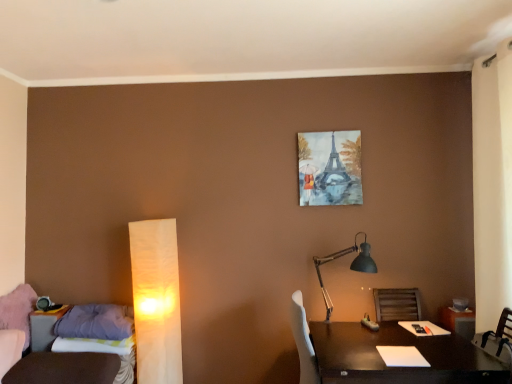
Question: Should I look upward or downward to see soft purple fabric at left?

Choices:
 (A) up
 (B) down

Answer: (B)

Question: From a real-world perspective, is purple fabric pillow at lower left beneath soft purple fabric at left?

Choices:
 (A) yes
 (B) no

Answer: (B)

Question: Are purple fabric pillow at lower left and soft purple fabric at left located far from each other?

Choices:
 (A) no
 (B) yes

Answer: (A)

Question: From the image's perspective, is purple fabric pillow at lower left on soft purple fabric at left?

Choices:
 (A) no
 (B) yes

Answer: (B)

Question: Considering the relative sizes of purple fabric pillow at lower left and soft purple fabric at left in the image provided, is purple fabric pillow at lower left shorter than soft purple fabric at left?

Choices:
 (A) yes
 (B) no

Answer: (B)

Question: Is the position of purple fabric pillow at lower left less distant than that of soft purple fabric at left?

Choices:
 (A) yes
 (B) no

Answer: (B)

Question: Is purple fabric pillow at lower left to the left of soft purple fabric at left from the viewer's perspective?

Choices:
 (A) yes
 (B) no

Answer: (B)

Question: Can you confirm if white paper lamp at left, arranged as the first lamp when viewed from the left, is taller than dark wood table at lower right?

Choices:
 (A) yes
 (B) no

Answer: (A)

Question: Does white paper lamp at left, positioned as the 2th lamp in right-to-left order, turn towards dark wood table at lower right?

Choices:
 (A) yes
 (B) no

Answer: (B)

Question: From the image's perspective, is white paper lamp at left, arranged as the first lamp when viewed from the left, on top of dark wood table at lower right?

Choices:
 (A) yes
 (B) no

Answer: (A)

Question: Is the depth of white paper lamp at left, positioned as the 2th lamp in right-to-left order, less than that of dark wood table at lower right?

Choices:
 (A) no
 (B) yes

Answer: (A)

Question: Considering the relative positions of white paper lamp at left, arranged as the first lamp when viewed from the left, and dark wood table at lower right in the image provided, is white paper lamp at left, arranged as the first lamp when viewed from the left, to the left of dark wood table at lower right from the viewer's perspective?

Choices:
 (A) yes
 (B) no

Answer: (A)

Question: Is white paper lamp at left, positioned as the 2th lamp in right-to-left order, bigger than dark wood table at lower right?

Choices:
 (A) no
 (B) yes

Answer: (A)

Question: Is dark wood table at lower right completely or partially inside purple fabric pillow at lower left?

Choices:
 (A) yes
 (B) no

Answer: (B)